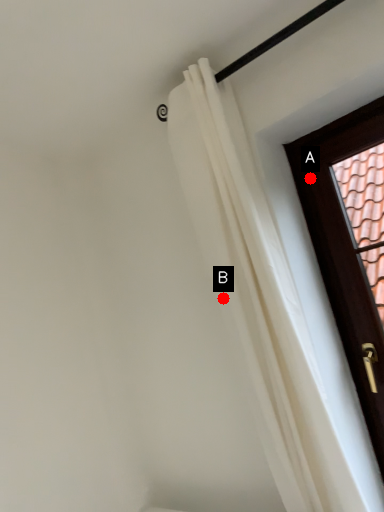
Question: Two points are circled on the image, labeled by A and B beside each circle. Which point appears farthest from the camera in this image?

Choices:
 (A) A is further
 (B) B is further

Answer: (A)